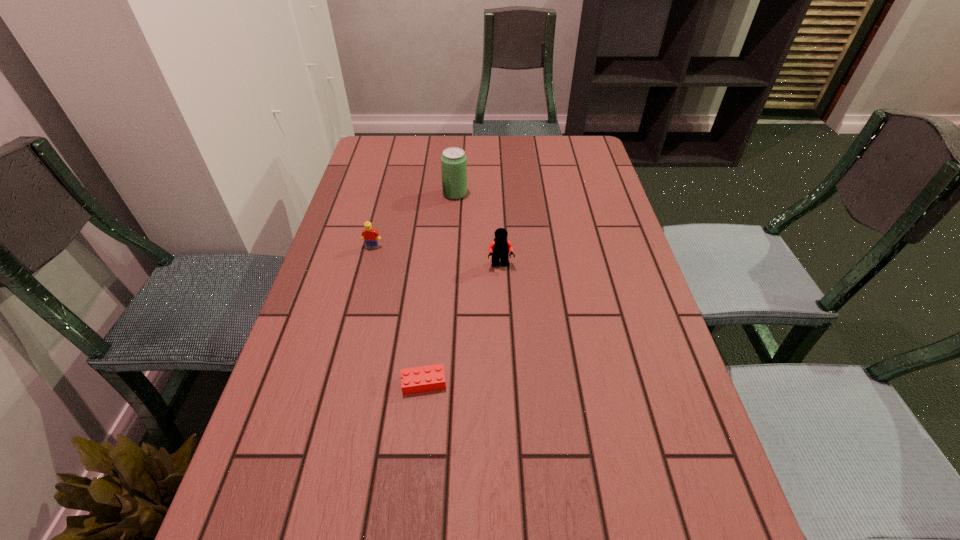
Where is `the tallest object`? the tallest object is located at coordinates (453, 160).

I want to click on soda, so click(453, 160).

In order to click on the third shortest object in this screenshot , I will do `click(499, 249)`.

Locate an element on the screen. the rightmost Lego is located at coordinates (499, 249).

The height and width of the screenshot is (540, 960). Identify the location of the leftmost Lego. (369, 235).

This screenshot has height=540, width=960. I want to click on the second tallest Lego, so click(x=369, y=235).

Locate an element on the screen. The width and height of the screenshot is (960, 540). the nearest Lego is located at coordinates (420, 379).

Where is `the nearest object`? This screenshot has height=540, width=960. the nearest object is located at coordinates (420, 379).

Find the location of `blank space located 0.200m on the back of the farthest object`. blank space located 0.200m on the back of the farthest object is located at coordinates pos(458,155).

Identify the location of vacant space located on the front-facing side of the third farthest object. (508, 407).